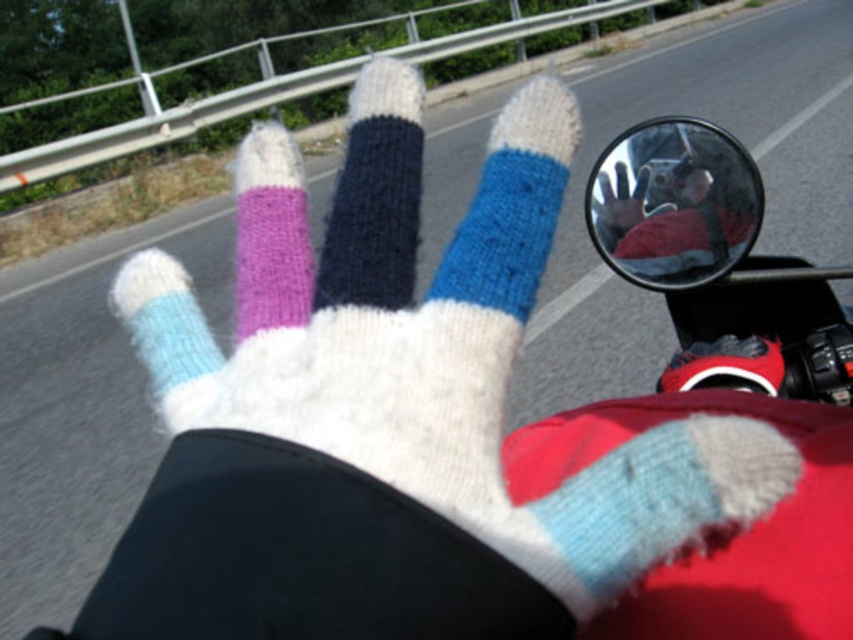
From the picture: You are a photographer trying to capture a closeup of the light blue knitted sock at lower right. The camera is 30.12 centimeters away from the sock. Is the distance sufficient for a clear photo?

The light blue knitted sock at lower right and camera are 30.12 centimeters apart from each other, so the distance is sufficient for a clear photo.

You are a passenger on a motorcycle and want to reach the purple knitted sock at center on the rider. The distance between you and the rider is 5.03 meters. Can you safely reach it without leaning too far?

The distance between you and the rider is 5.03 meters, so you cannot safely reach the purple knitted sock at center without leaning too far.

You are a fashion designer examining a glove and sock design. Given the light blue knitted sock at lower right and the white knitted glove at center, which one is wider?

The light blue knitted sock at lower right is wider than the white knitted glove at center.